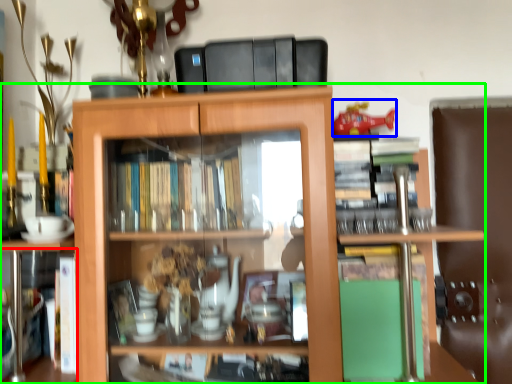
Question: Based on their relative distances, which object is farther from book (highlighted by a red box)? Choose from toy (highlighted by a blue box) and shelf (highlighted by a green box).

Choices:
 (A) toy
 (B) shelf

Answer: (A)